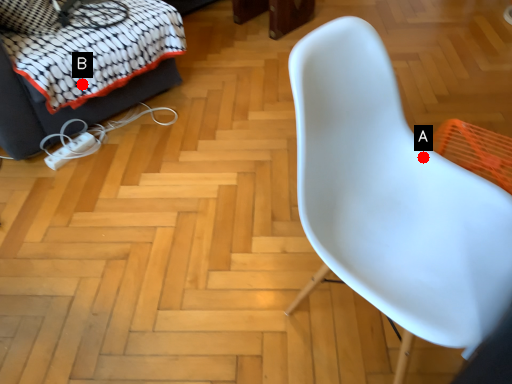
Question: Two points are circled on the image, labeled by A and B beside each circle. Which point is closer to the camera?

Choices:
 (A) A is closer
 (B) B is closer

Answer: (A)